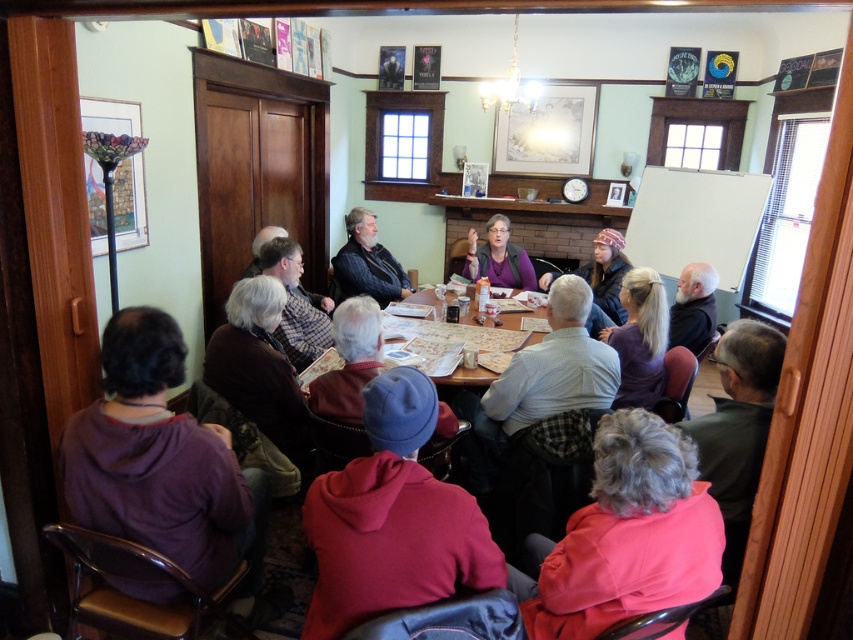
Question: Which object is closer to the camera taking this photo?

Choices:
 (A) dark gray sweater at center
 (B) red fleece jacket at center

Answer: (B)

Question: Does gray woolen sweater at lower left appear over blonde hair at center?

Choices:
 (A) no
 (B) yes

Answer: (A)

Question: Does pink fabric at lower right have a lesser width compared to dark gray sweater at center?

Choices:
 (A) no
 (B) yes

Answer: (B)

Question: Is red fleece jacket at center thinner than dark gray sweater at center?

Choices:
 (A) yes
 (B) no

Answer: (A)

Question: Which object is the farthest from the dark gray sweater at center?

Choices:
 (A) plaid fabric shirt at center
 (B) pink fabric at lower right

Answer: (B)

Question: Which point is closer to the camera?

Choices:
 (A) (392, 540)
 (B) (352, 227)

Answer: (A)